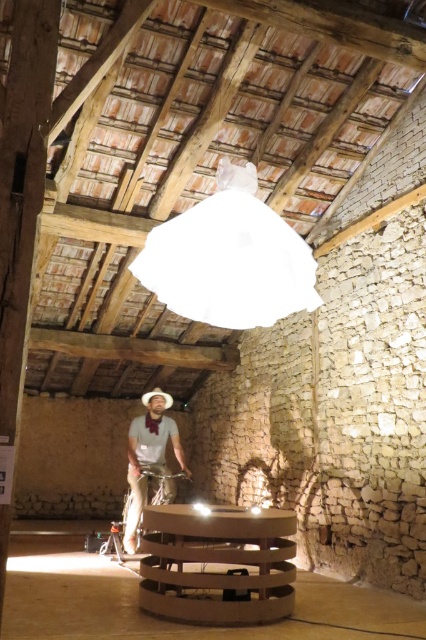
Can you confirm if light brown leather jacket at center is bigger than brown felt cowboy hat at center?

Yes.

Who is positioned more to the left, light brown leather jacket at center or brown felt cowboy hat at center?

Positioned to the left is light brown leather jacket at center.

Which is in front, point (155, 419) or point (155, 390)?

Point (155, 419)

Image resolution: width=426 pixels, height=640 pixels. Identify the location of light brown leather jacket at center. (149, 454).

Does white matte lampshade at upper center have a larger size compared to light brown leather jacket at center?

No.

Does point (270, 244) come farther from viewer compared to point (160, 460)?

No, (270, 244) is closer to viewer.

Find the location of `white matte lampshade at upper center`. white matte lampshade at upper center is located at coordinates (229, 259).

Can you confirm if white matte lampshade at upper center is bigger than brown felt cowboy hat at center?

Indeed, white matte lampshade at upper center has a larger size compared to brown felt cowboy hat at center.

Which of these two, white matte lampshade at upper center or brown felt cowboy hat at center, stands shorter?

Standing shorter between the two is brown felt cowboy hat at center.

Describe the element at coordinates (229, 259) in the screenshot. Image resolution: width=426 pixels, height=640 pixels. I see `white matte lampshade at upper center` at that location.

Where is `white matte lampshade at upper center`? Image resolution: width=426 pixels, height=640 pixels. white matte lampshade at upper center is located at coordinates (229, 259).